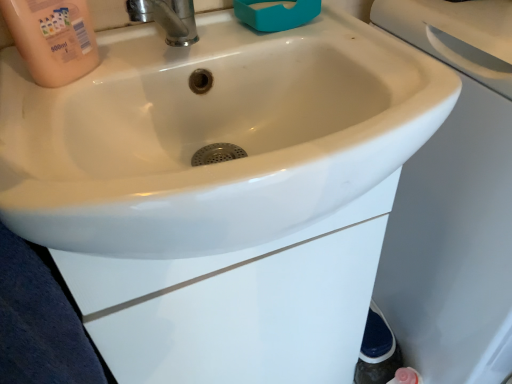
Question: From the image's perspective, is pink matte bottle at upper left on top of white glossy sink at center?

Choices:
 (A) yes
 (B) no

Answer: (A)

Question: Is pink matte bottle at upper left far away from white glossy sink at center?

Choices:
 (A) yes
 (B) no

Answer: (B)

Question: Can you confirm if pink matte bottle at upper left is wider than white glossy sink at center?

Choices:
 (A) yes
 (B) no

Answer: (B)

Question: Considering the relative sizes of pink matte bottle at upper left and white glossy sink at center in the image provided, is pink matte bottle at upper left bigger than white glossy sink at center?

Choices:
 (A) no
 (B) yes

Answer: (A)

Question: From a real-world perspective, is pink matte bottle at upper left beneath white glossy sink at center?

Choices:
 (A) no
 (B) yes

Answer: (A)

Question: Is pink matte bottle at upper left turned away from white glossy sink at center?

Choices:
 (A) no
 (B) yes

Answer: (A)

Question: Is white glossy sink at center in front of polished chrome tap at upper center?

Choices:
 (A) no
 (B) yes

Answer: (B)

Question: Can you confirm if white glossy sink at center is bigger than polished chrome tap at upper center?

Choices:
 (A) yes
 (B) no

Answer: (A)

Question: From the image's perspective, does white glossy sink at center appear higher than polished chrome tap at upper center?

Choices:
 (A) yes
 (B) no

Answer: (B)

Question: Is white glossy sink at center aimed at polished chrome tap at upper center?

Choices:
 (A) yes
 (B) no

Answer: (B)

Question: Is white glossy sink at center at the left side of polished chrome tap at upper center?

Choices:
 (A) no
 (B) yes

Answer: (A)

Question: From the image's perspective, is white glossy sink at center beneath polished chrome tap at upper center?

Choices:
 (A) yes
 (B) no

Answer: (A)

Question: Is polished chrome tap at upper center wider than white glossy sink at center?

Choices:
 (A) yes
 (B) no

Answer: (B)